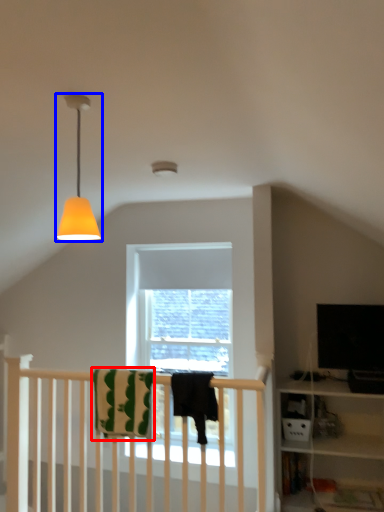
Question: Which of the following is the closest to the observer, beach towel (highlighted by a red box) or lamp (highlighted by a blue box)?

Choices:
 (A) beach towel
 (B) lamp

Answer: (B)